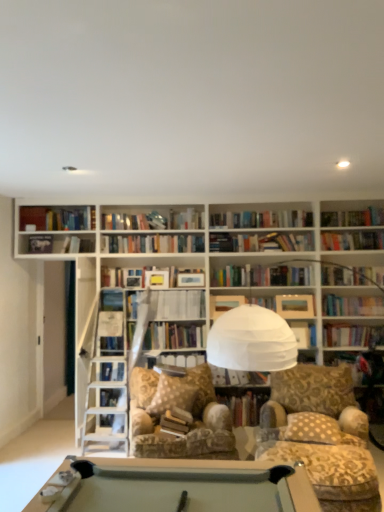
Question: Do you think beige dotted pillow at center is within hardcover book at center, which is the 1th book in bottom-to-top order, or outside of it?

Choices:
 (A) inside
 (B) outside

Answer: (B)

Question: Is beige dotted pillow at center in front of or behind hardcover book at center, which is counted as the first book, starting from the right, in the image?

Choices:
 (A) front
 (B) behind

Answer: (A)

Question: Based on their relative distances, which object is nearer to the hardcover book at upper left, the first paperback book from the left?

Choices:
 (A) patterned fabric swivel chair at center
 (B) hardcover book at center, which is the first paperback book in right-to-left order
 (C) hardcover book at center, placed as the second book when sorted from left to right
 (D) patterned fabric chair at center
 (E) hardcover book at center, which is the fourth paperback book in left-to-right order

Answer: (C)

Question: Estimate the real-world distances between objects in this image. Which object is closer to the hardcover book at center, the fourth paperback book in the top-to-bottom sequence?

Choices:
 (A) hardcover book at center, the third book from the top
 (B) hardcover book at center, which appears as the 1th book when viewed from the top
 (C) beige dotted pillow at center
 (D) white paper at center, acting as the second book starting from the top
 (E) hardcover book at upper left, marked as the first paperback book in a top-to-bottom arrangement

Answer: (D)